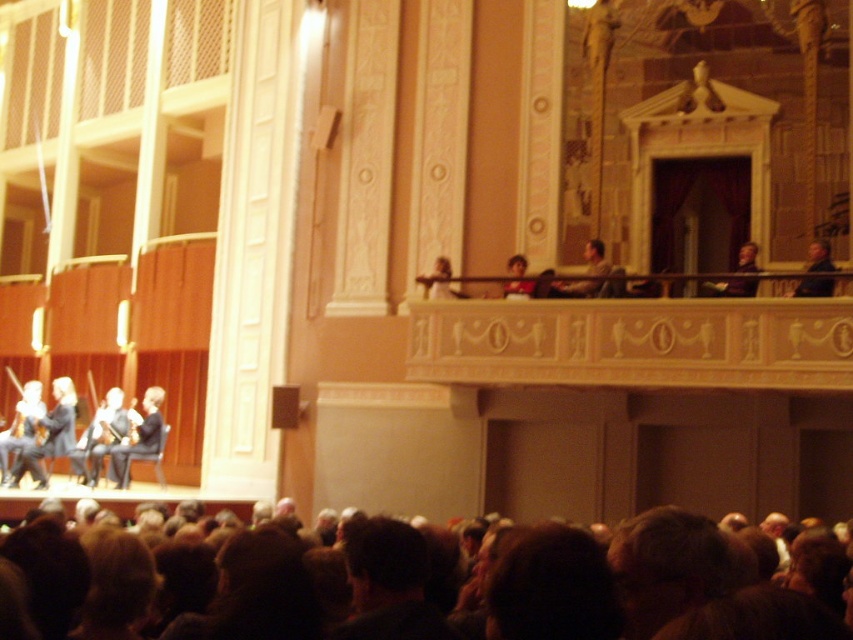
You are sitting in the audience of the concert hall and want to look at two points on the stage. The first point is at coordinate point (189,628) and the second is at point (61,384). Which point will appear closer to your eyes?

Point (189,628) is closer to the viewer than point (61,384), so the first point will appear closer to your eyes.

You are an usher in the concert hall and need to direct a guest to the front row seats. The guest asks which performer is closer to the audience between the light gray suit at stage left and the light brown leather jacket at upper center. How do you respond?

The light gray suit at stage left is closer to the audience than the light brown leather jacket at upper center because it is further to the viewer.